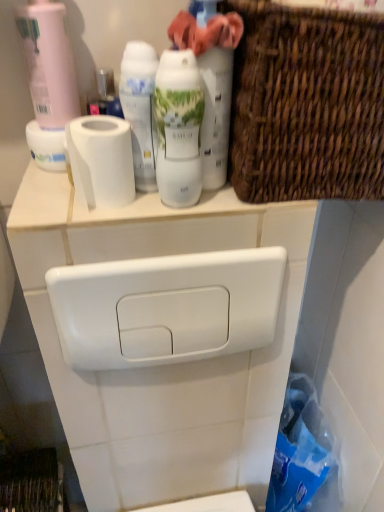
Question: Is white glossy shaving cream at center, which appears as the 1th shaving cream when viewed from the left, thinner than pink matte bottle at upper left, the 2th cleaning product positioned from the right?

Choices:
 (A) no
 (B) yes

Answer: (B)

Question: From a real-world perspective, is white glossy shaving cream at center, which appears as the 1th shaving cream when viewed from the left, physically below pink matte bottle at upper left, the 2th cleaning product positioned from the right?

Choices:
 (A) no
 (B) yes

Answer: (B)

Question: Is white glossy shaving cream at center, arranged as the 2th shaving cream when viewed from the right, oriented away from pink matte bottle at upper left, the 2th cleaning product positioned from the right?

Choices:
 (A) yes
 (B) no

Answer: (B)

Question: Does white glossy shaving cream at center, which appears as the 1th shaving cream when viewed from the left, touch pink matte bottle at upper left, positioned as the first cleaning product in left-to-right order?

Choices:
 (A) yes
 (B) no

Answer: (B)

Question: Is white glossy shaving cream at center, which appears as the 1th shaving cream when viewed from the left, in front of pink matte bottle at upper left, the 2th cleaning product positioned from the right?

Choices:
 (A) no
 (B) yes

Answer: (B)

Question: From a real-world perspective, is white glossy shaving cream at center, arranged as the 2th shaving cream when viewed from the right, physically above pink matte bottle at upper left, positioned as the first cleaning product in left-to-right order?

Choices:
 (A) yes
 (B) no

Answer: (B)

Question: From a real-world perspective, is matte white spray can at upper center, placed as the second cleaning product when sorted from left to right, located beneath white glossy toilet tank at upper center?

Choices:
 (A) no
 (B) yes

Answer: (A)

Question: Can you confirm if matte white spray can at upper center, which is counted as the 1th cleaning product, starting from the right, is thinner than white glossy toilet tank at upper center?

Choices:
 (A) no
 (B) yes

Answer: (A)

Question: Is matte white spray can at upper center, placed as the second cleaning product when sorted from left to right, positioned beyond the bounds of white glossy toilet tank at upper center?

Choices:
 (A) yes
 (B) no

Answer: (A)

Question: Does matte white spray can at upper center, placed as the second cleaning product when sorted from left to right, turn towards white glossy toilet tank at upper center?

Choices:
 (A) yes
 (B) no

Answer: (B)

Question: Considering the relative positions of matte white spray can at upper center, which is counted as the 1th cleaning product, starting from the right, and white glossy toilet tank at upper center in the image provided, is matte white spray can at upper center, which is counted as the 1th cleaning product, starting from the right, to the right of white glossy toilet tank at upper center from the viewer's perspective?

Choices:
 (A) no
 (B) yes

Answer: (B)

Question: Are matte white spray can at upper center, which is counted as the 1th cleaning product, starting from the right, and white glossy toilet tank at upper center far apart?

Choices:
 (A) no
 (B) yes

Answer: (A)

Question: Is matte white spray can at upper center, placed as the second cleaning product when sorted from left to right, oriented away from woven brown basket at upper right?

Choices:
 (A) no
 (B) yes

Answer: (A)